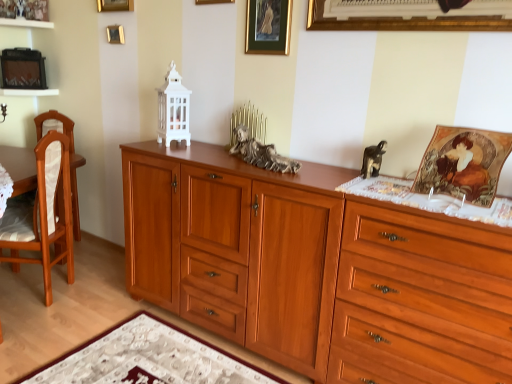
Question: Which is correct: white textured mat at lower center is inside bronze statue at center, which is the first animal in left-to-right order, or outside of it?

Choices:
 (A) outside
 (B) inside

Answer: (A)

Question: Relative to bronze statue at center, which is the first animal in left-to-right order, is white textured mat at lower center in front or behind?

Choices:
 (A) behind
 (B) front

Answer: (B)

Question: Estimate the real-world distances between objects in this image. Which object is farther from the white textured mat at lower center?

Choices:
 (A) bronze statue at center, the second animal in the right-to-left sequence
 (B) light brown wood chair at left
 (C) gold metallic picture frame at upper left, the 3th picture frame from the bottom
 (D) shiny brown chest of drawers at right
 (E) black glossy monkey at upper right, the first animal when ordered from right to left

Answer: (C)

Question: Considering the real-world distances, which object is farthest from the light brown wood chair at left?

Choices:
 (A) black glossy monkey at upper right, which ranks as the 2th animal in left-to-right order
 (B) white textured mat at lower center
 (C) gold metallic picture frame at upper left, the 1th picture frame viewed from the back
 (D) matte gold picture frame at upper right, marked as the 5th picture frame in a back-to-front arrangement
 (E) shiny brown chest of drawers at right

Answer: (D)